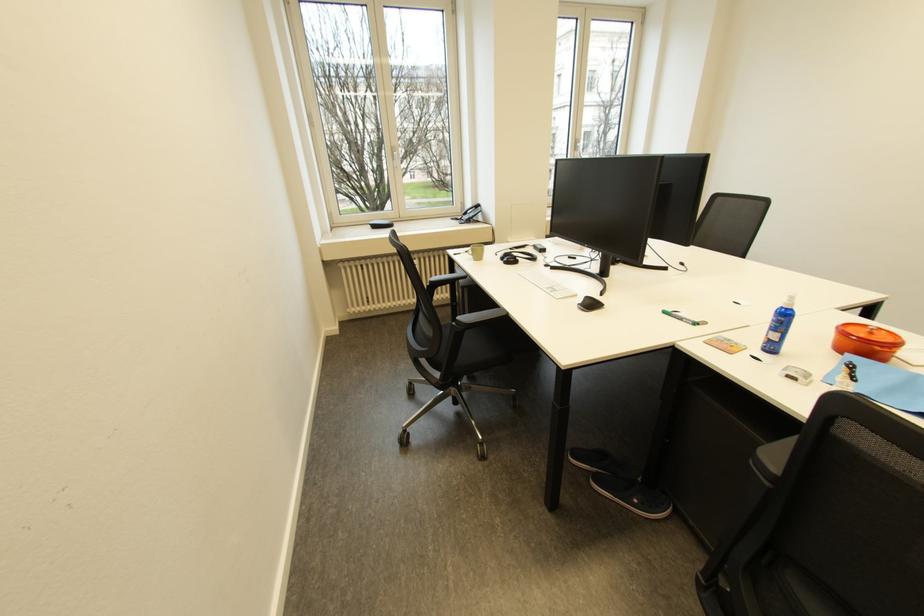
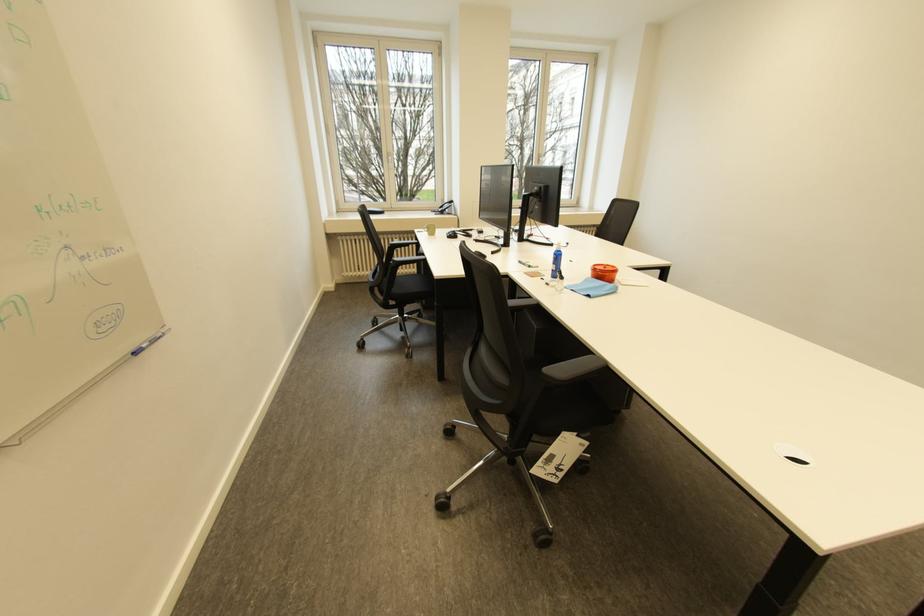
Locate, in the second image, the point that corresponds to (x=360, y=167) in the first image.

(386, 171)